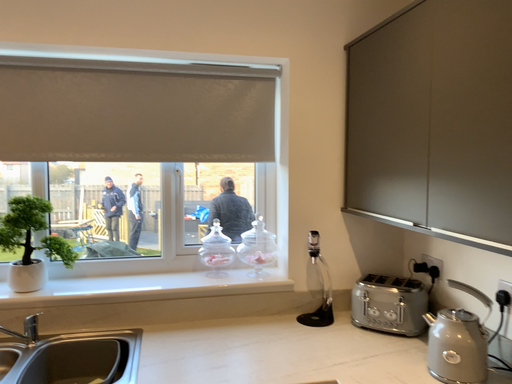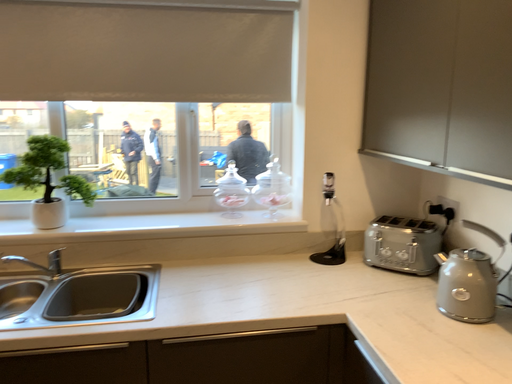
Question: Which way did the camera rotate in the video?

Choices:
 (A) rotated downward
 (B) rotated upward

Answer: (A)